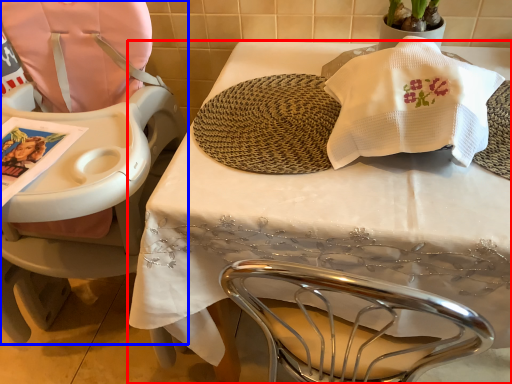
Question: Which point is further to the camera, table (highlighted by a red box) or chair (highlighted by a blue box)?

Choices:
 (A) table
 (B) chair

Answer: (A)